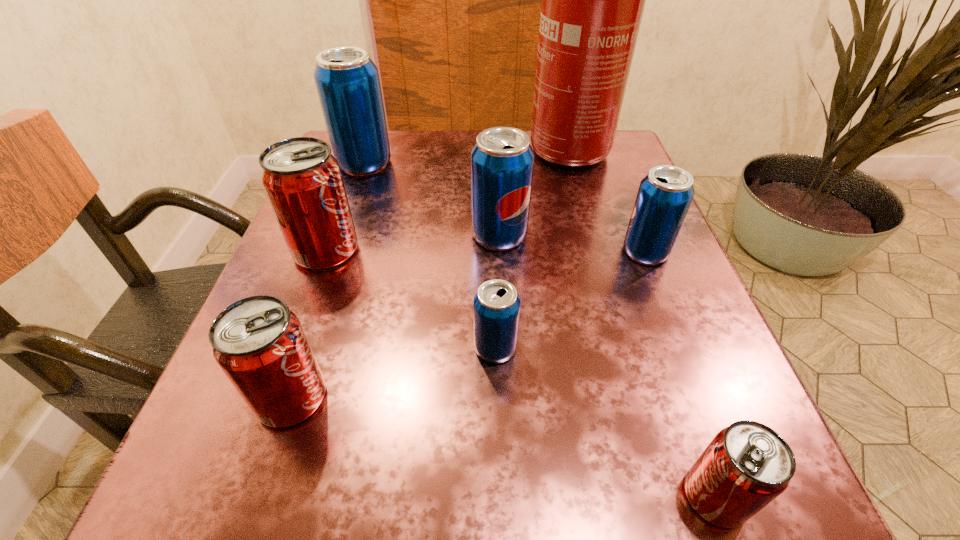
You are a GUI agent. You are given a task and a screenshot of the screen. Output one action in this format:
    pyautogui.click(x=<x>, y=<y>)
    Task: Click on the nearest blue pop soda
    This screenshot has width=960, height=540.
    Given the screenshot: What is the action you would take?
    pyautogui.click(x=496, y=309)

At what (x,y) coordinates should I click in order to perform the action: click on the nearest red pop soda. Please return your answer as a coordinate pair (x, y). This screenshot has height=540, width=960. Looking at the image, I should click on (747, 465).

The height and width of the screenshot is (540, 960). Find the location of `the nearest pop soda`. the nearest pop soda is located at coordinates (747, 465).

This screenshot has width=960, height=540. What are the coordinates of `blank space located on the trigger side of the tallest object` in the screenshot? It's located at (359, 152).

Identify the location of free space located on the trigger side of the tallest object. (444, 152).

The width and height of the screenshot is (960, 540). What are the coordinates of `blank space located 0.360m on the trigger side of the tallest object` in the screenshot? It's located at (350, 152).

Where is `vacant space located on the front of the biggest blue pop soda`? This screenshot has height=540, width=960. vacant space located on the front of the biggest blue pop soda is located at coordinates (319, 292).

Identify the location of vacant space situated 0.210m on the front of the third smallest blue pop soda. The height and width of the screenshot is (540, 960). (505, 350).

I want to click on free space located 0.220m on the front of the farthest red pop soda, so click(276, 388).

Where is `vacant space located on the left of the rightmost blue pop soda`? The image size is (960, 540). vacant space located on the left of the rightmost blue pop soda is located at coordinates (594, 252).